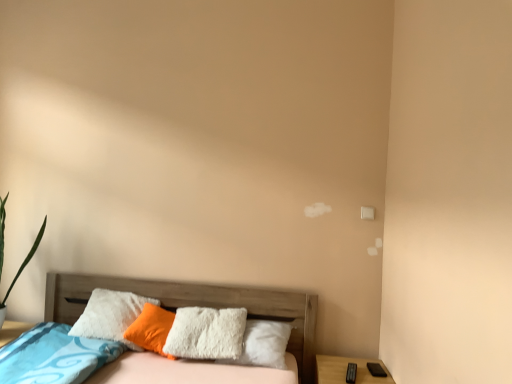
Question: Is point (253, 301) closer or farther from the camera than point (138, 327)?

Choices:
 (A) closer
 (B) farther

Answer: (B)

Question: From their relative heights in the image, would you say wooden bed at lower left is taller or shorter than white fluffy pillow at center?

Choices:
 (A) tall
 (B) short

Answer: (A)

Question: Which is nearer to the wooden bed at lower left?

Choices:
 (A) white fluffy pillow at center
 (B) wooden nightstand at lower right

Answer: (A)

Question: Which is farther from the wooden nightstand at lower right?

Choices:
 (A) white fluffy pillow at center
 (B) wooden bed at lower left

Answer: (A)